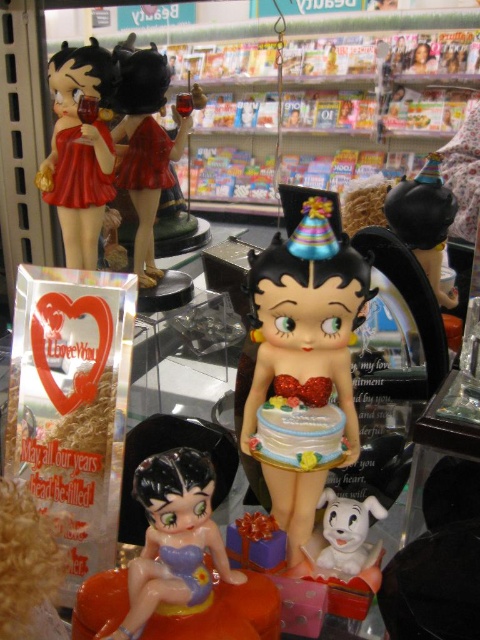
Question: Is matte red figurine at upper left further to the viewer compared to white glossy dog at lower center?

Choices:
 (A) yes
 (B) no

Answer: (A)

Question: Which of the following is the closest to the observer?

Choices:
 (A) (310, 474)
 (B) (153, 120)

Answer: (A)

Question: Which is farther from the shiny black figurine at upper right?

Choices:
 (A) white glossy dog at lower center
 (B) shiny red dress at upper left

Answer: (A)

Question: Among these objects, which one is nearest to the camera?

Choices:
 (A) matte plastic figurine at upper left
 (B) matte red figurine at upper left

Answer: (A)

Question: Can you confirm if matte plastic figurine at upper left is positioned to the right of shiny red dress at upper left?

Choices:
 (A) yes
 (B) no

Answer: (B)

Question: Is shiny plastic figurine at center wider than matte plastic figurine at upper left?

Choices:
 (A) no
 (B) yes

Answer: (B)